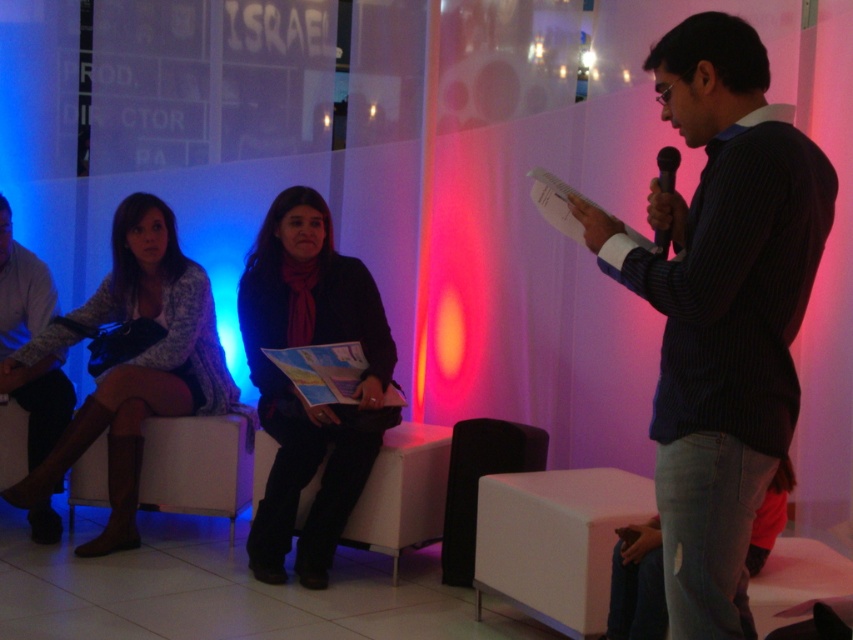
Question: Is blue striped shirt at center further to camera compared to knit sweater at left?

Choices:
 (A) yes
 (B) no

Answer: (B)

Question: Considering the real-world distances, which object is farthest from the light brown leather shoes at lower left?

Choices:
 (A) blue striped shirt at center
 (B) black plastic microphone at upper right

Answer: (B)

Question: Does white fabric chair at center come in front of light brown leather shoes at lower left?

Choices:
 (A) no
 (B) yes

Answer: (B)

Question: Does knit sweater at left have a greater width compared to light brown leather shoes at lower left?

Choices:
 (A) yes
 (B) no

Answer: (A)

Question: Which of the following is the farthest from the observer?

Choices:
 (A) click(x=659, y=154)
 (B) click(x=318, y=474)

Answer: (B)

Question: Which point appears closest to the camera in this image?

Choices:
 (A) (723, 120)
 (B) (672, 193)
 (C) (26, 385)
 (D) (440, 477)

Answer: (A)